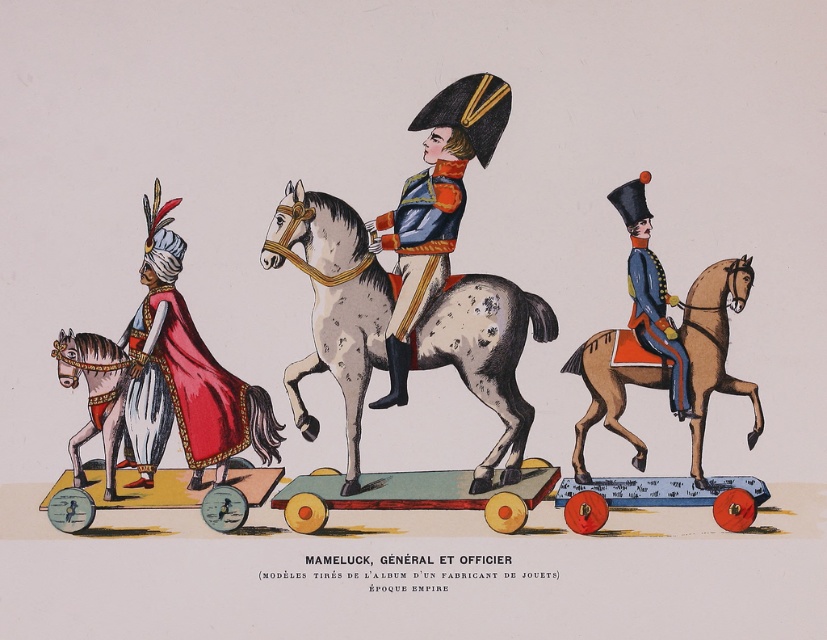
Question: Estimate the real-world distances between objects in this image. Which object is closer to the white speckled horse at left?

Choices:
 (A) blue satin vest at center
 (B) velvet red cape at left
 (C) shiny blue uniform at center
 (D) brown leather horse at right

Answer: (B)

Question: Is shiny blue uniform at center to the left of blue glossy uniform at center from the viewer's perspective?

Choices:
 (A) yes
 (B) no

Answer: (A)

Question: Which of these objects is positioned closest to the velvet red cape at left?

Choices:
 (A) matte red cape at left
 (B) blue satin uniform at right
 (C) shiny blue uniform at center

Answer: (A)

Question: Does matte red cape at left appear on the right side of shiny blue uniform at center?

Choices:
 (A) no
 (B) yes

Answer: (A)

Question: Which of the following is the farthest from the observer?

Choices:
 (A) (682, 352)
 (B) (154, 268)
 (C) (547, 333)

Answer: (B)

Question: Is speckled gray horse at center in front of shiny blue uniform at center?

Choices:
 (A) yes
 (B) no

Answer: (A)